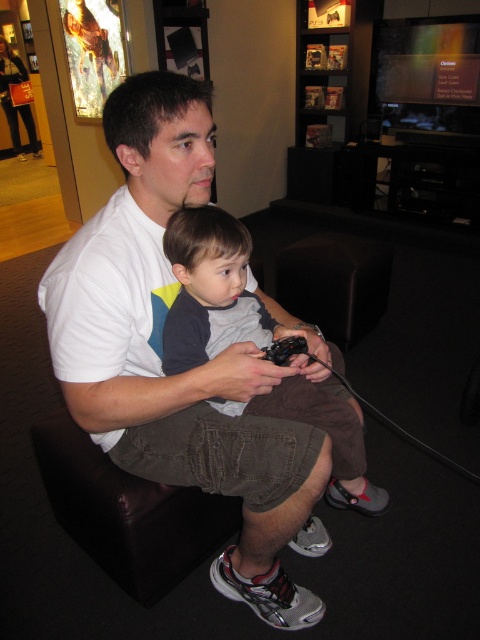
Question: Is white cotton shirt at center to the left of gray cotton shirt at center from the viewer's perspective?

Choices:
 (A) yes
 (B) no

Answer: (A)

Question: Is white cotton shirt at center positioned in front of gray cotton shirt at center?

Choices:
 (A) yes
 (B) no

Answer: (A)

Question: Does white cotton shirt at center appear over gray cotton shirt at center?

Choices:
 (A) yes
 (B) no

Answer: (A)

Question: Which point appears farthest from the camera in this image?

Choices:
 (A) pyautogui.click(x=80, y=380)
 (B) pyautogui.click(x=345, y=468)

Answer: (B)

Question: Which point appears farthest from the camera in this image?

Choices:
 (A) tap(204, 332)
 (B) tap(304, 612)

Answer: (B)

Question: Which point is closer to the camera taking this photo?

Choices:
 (A) (119, 92)
 (B) (197, 209)

Answer: (A)